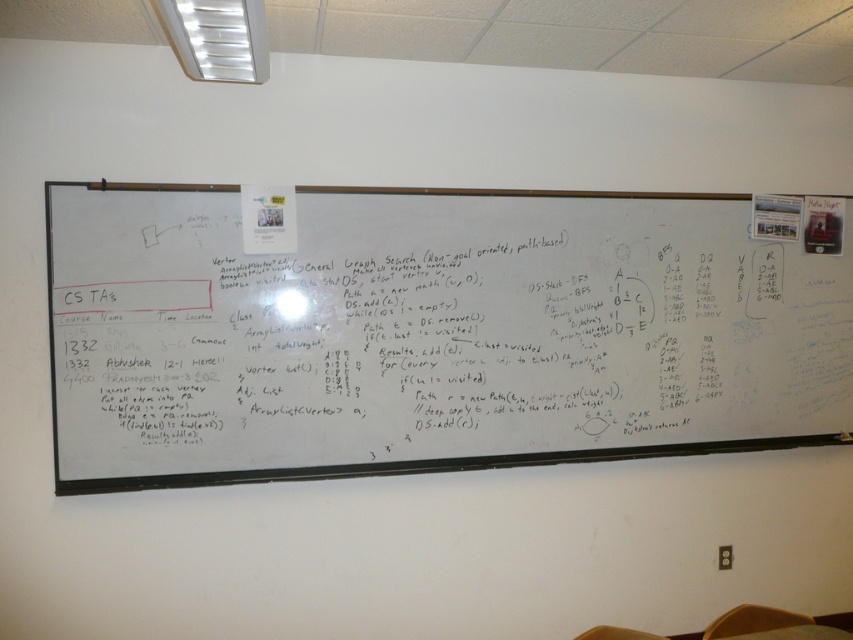
What are the coordinates of the whiteboard at center?

The whiteboard at center is located at point (434, 330).